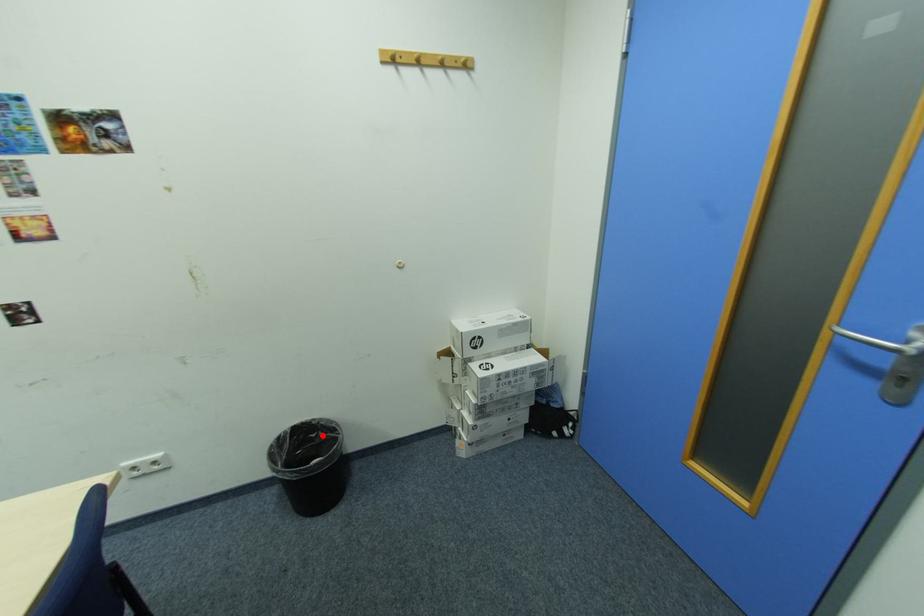
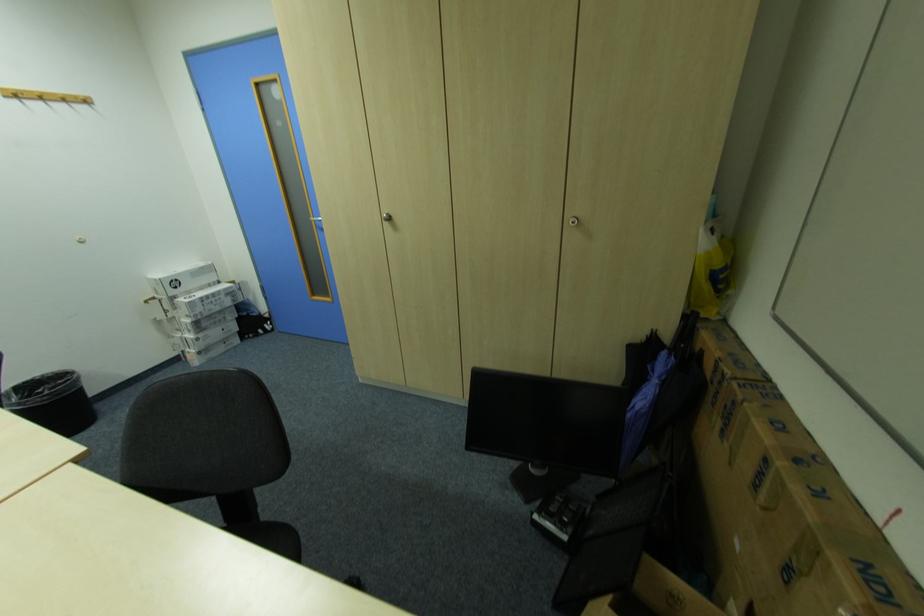
The point at the highlighted location is marked in the first image. Where is the corresponding point in the second image?

(49, 391)